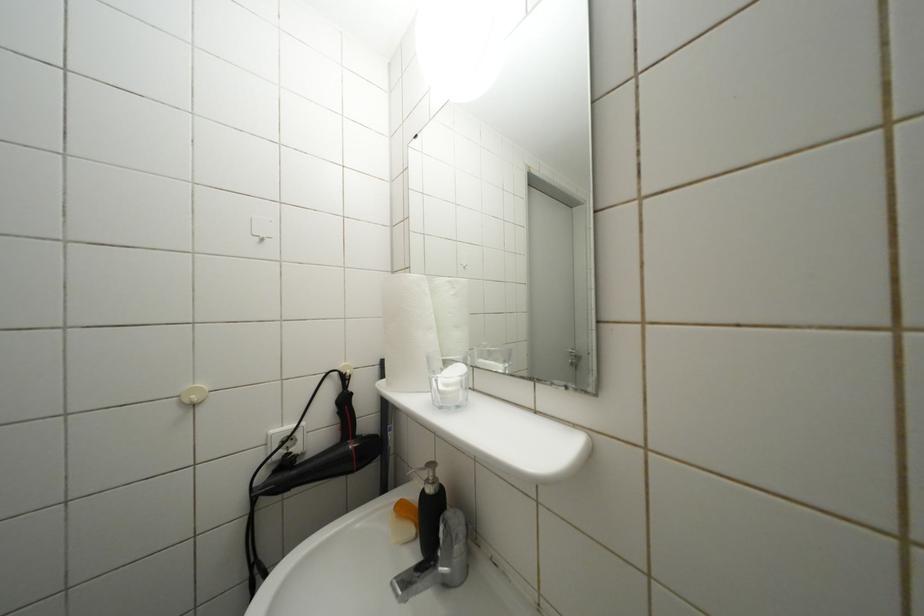
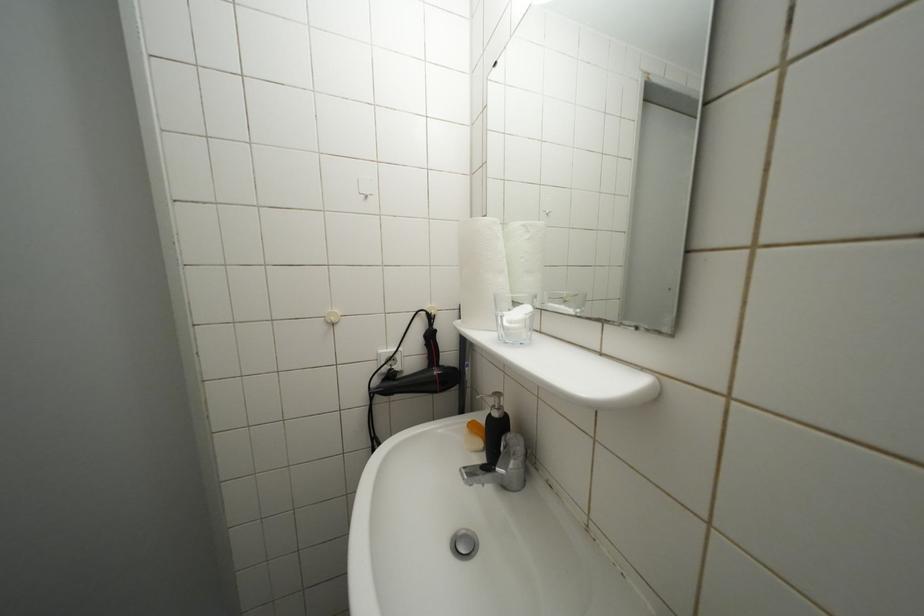
Question: The images are taken continuously from a first-person perspective. In which direction is your viewpoint rotating?

Choices:
 (A) Left
 (B) Right
 (C) Up
 (D) Down

Answer: (A)